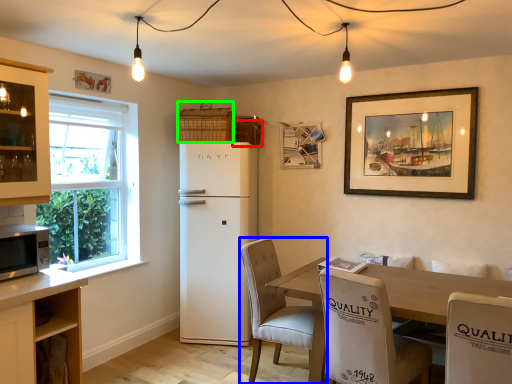
Question: Based on their relative distances, which object is nearer to basket (highlighted by a red box)? Choose from chair (highlighted by a blue box) and basket (highlighted by a green box).

Choices:
 (A) chair
 (B) basket

Answer: (B)